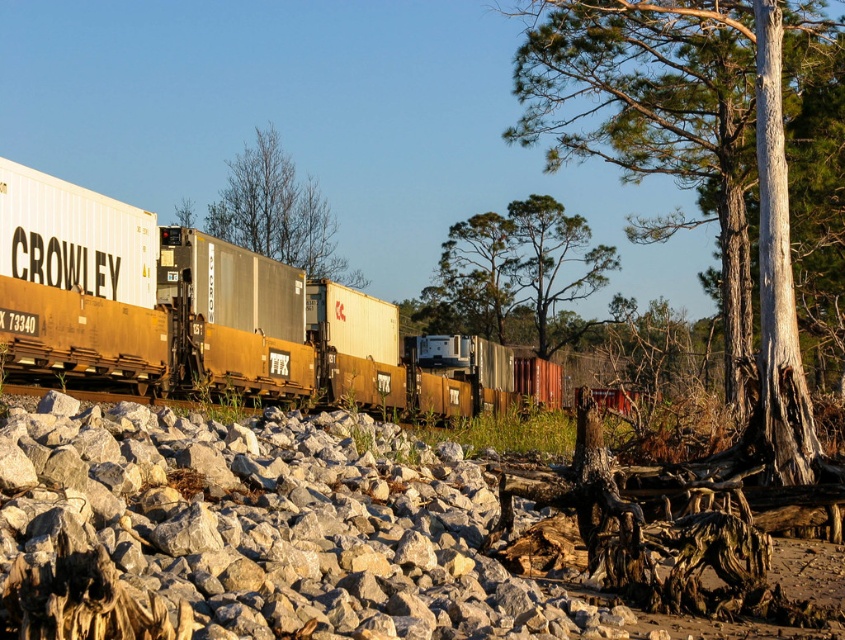
Question: Does rusty metal train car at center have a smaller size compared to smooth gray bark at center right?

Choices:
 (A) yes
 (B) no

Answer: (A)

Question: Which object is the closest to the smooth gray bark at center right?

Choices:
 (A) bare branches at center
 (B) green leafy tree at center
 (C) rusty metal train car at center

Answer: (C)

Question: Which of these objects is positioned farthest from the green leafy tree at center?

Choices:
 (A) smooth gray bark at center right
 (B) bare branches at center
 (C) rusty metal train car at center

Answer: (C)

Question: Does smooth gray bark at center right appear under green leafy tree at center?

Choices:
 (A) no
 (B) yes

Answer: (A)

Question: Can you confirm if smooth gray bark at center right is thinner than bare branches at center?

Choices:
 (A) yes
 (B) no

Answer: (A)

Question: Which point appears closest to the camera in this image?

Choices:
 (A) (530, 33)
 (B) (559, 237)

Answer: (A)